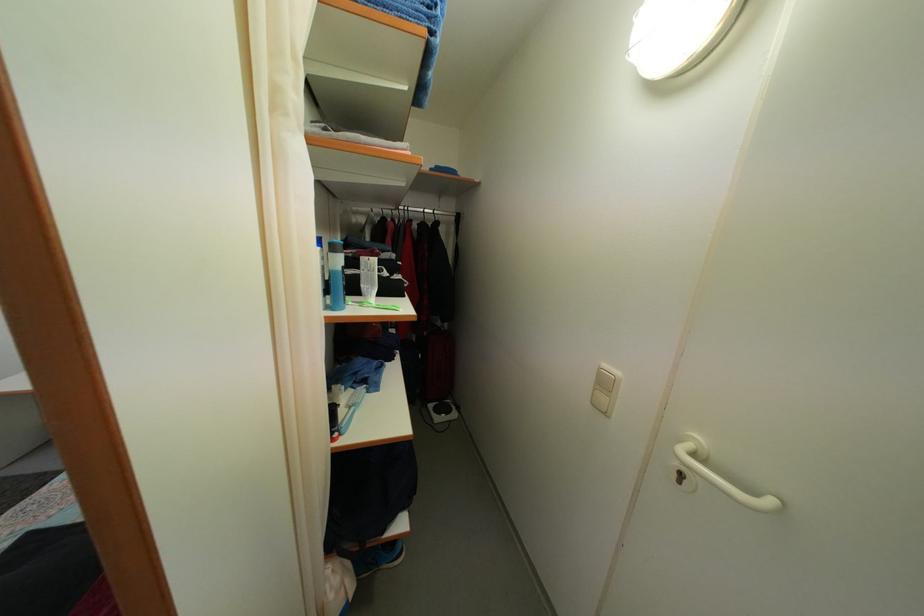
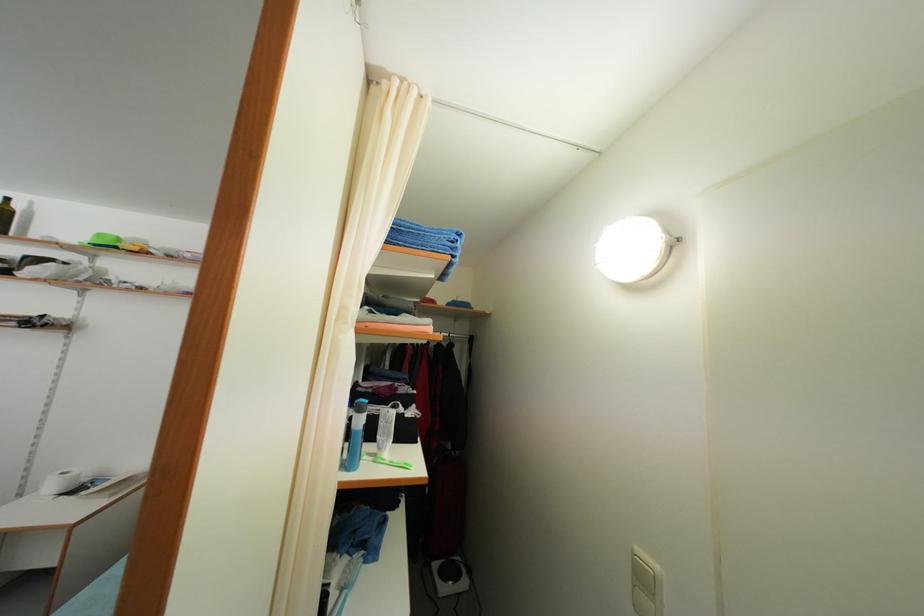
Question: The images are taken continuously from a first-person perspective. In which direction are you moving?

Choices:
 (A) Left
 (B) Right
 (C) Forward
 (D) Backward

Answer: (D)